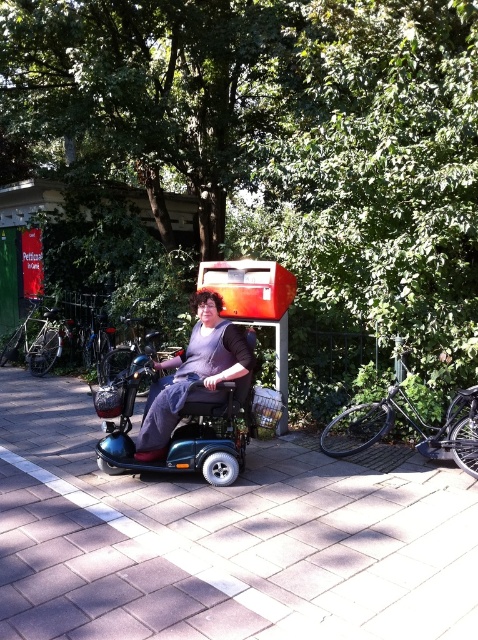
Question: Which point appears farthest from the camera in this image?

Choices:
 (A) (242, 380)
 (B) (430, 444)
 (C) (380, 582)

Answer: (B)

Question: Can you confirm if brick pavement at center is positioned to the left of black matte bicycle at right?

Choices:
 (A) yes
 (B) no

Answer: (A)

Question: Is brick pavement at center behind teal plastic wheelchair at center?

Choices:
 (A) no
 (B) yes

Answer: (A)

Question: Estimate the real-world distances between objects in this image. Which object is closer to the black matte bicycle at right?

Choices:
 (A) brick pavement at center
 (B) teal plastic wheelchair at center

Answer: (A)

Question: Is brick pavement at center positioned before teal plastic wheelchair at center?

Choices:
 (A) yes
 (B) no

Answer: (A)

Question: Which of the following is the closest to the observer?

Choices:
 (A) (228, 355)
 (B) (90, 497)
 (C) (360, 449)

Answer: (B)